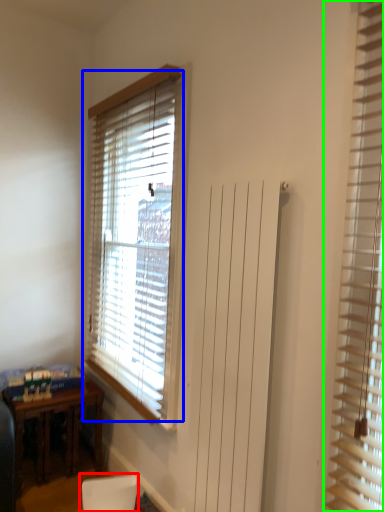
Question: Based on their relative distances, which object is nearer to armchair (highlighted by a red box)? Choose from window blind (highlighted by a blue box) and window blind (highlighted by a green box).

Choices:
 (A) window blind
 (B) window blind

Answer: (A)